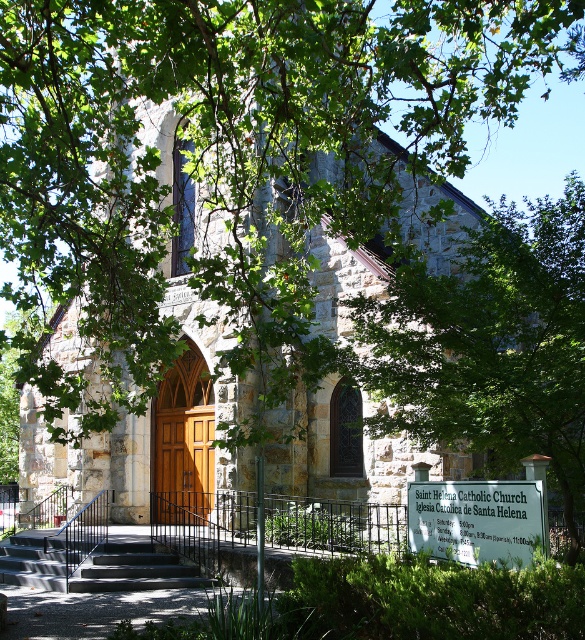
Can you confirm if stone church at center is thinner than green leafy tree at lower right?

No, stone church at center is not thinner than green leafy tree at lower right.

Which is more to the right, stone church at center or green leafy tree at lower right?

From the viewer's perspective, green leafy tree at lower right appears more on the right side.

Is point (318, 198) behind point (548, 268)?

No, (318, 198) is in front of (548, 268).

Where is `stone church at center`? stone church at center is located at coordinates (234, 192).

Does point (521, 344) come farther from viewer compared to point (29, 544)?

No, (521, 344) is closer to viewer.

Between point (526, 212) and point (39, 550), which one is positioned behind?

Positioned behind is point (526, 212).

Between point (433, 276) and point (132, 586), which one is positioned in front?

Positioned in front is point (132, 586).

The image size is (585, 640). Find the location of `green leafy tree at lower right`. green leafy tree at lower right is located at coordinates (488, 344).

Does stone church at center have a lesser width compared to dark gray concrete stairs at center?

No, stone church at center is not thinner than dark gray concrete stairs at center.

Who is more forward, (x=349, y=401) or (x=56, y=556)?

Point (x=56, y=556)

Between point (98, 410) and point (111, 572), which one is positioned in front?

Point (111, 572) is more forward.

You are a GUI agent. You are given a task and a screenshot of the screen. Output one action in this format:
    pyautogui.click(x=<x>, y=<y>)
    Task: Click on the stone church at center
    This screenshot has width=585, height=640.
    Given the screenshot: What is the action you would take?
    pyautogui.click(x=234, y=192)